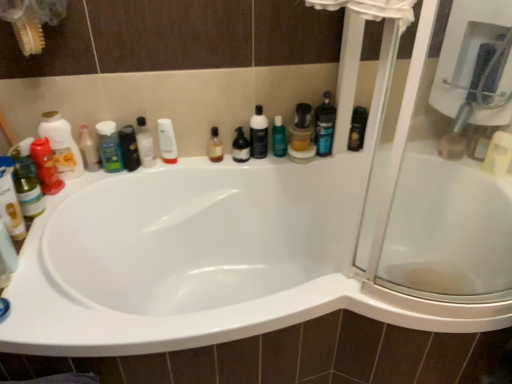
Question: Is black plastic bottle at upper right, the first toiletry when ordered from right to left, next to black glossy bottle at upper left, which is the 1th mouthwash in left-to-right order, and touching it?

Choices:
 (A) no
 (B) yes

Answer: (A)

Question: Can black glossy bottle at upper left, which is the 1th mouthwash in left-to-right order, be found inside black plastic bottle at upper right, the eighth toiletry when ordered from left to right?

Choices:
 (A) no
 (B) yes

Answer: (A)

Question: From the image's perspective, does black plastic bottle at upper right, the eighth toiletry when ordered from left to right, appear lower than black glossy bottle at upper left, the third mouthwash from the right?

Choices:
 (A) yes
 (B) no

Answer: (B)

Question: Is black plastic bottle at upper right, the eighth toiletry when ordered from left to right, positioned in front of black glossy bottle at upper left, which is the 1th mouthwash in left-to-right order?

Choices:
 (A) yes
 (B) no

Answer: (B)

Question: Is black plastic bottle at upper right, the eighth toiletry when ordered from left to right, at the right side of black glossy bottle at upper left, the third mouthwash from the right?

Choices:
 (A) yes
 (B) no

Answer: (A)

Question: Choose the correct answer: Is translucent plastic bottle at center, placed as the second mouthwash when sorted from left to right, inside matte red shampoo at left, arranged as the eighth toiletry when viewed from the right, or outside it?

Choices:
 (A) outside
 (B) inside

Answer: (A)

Question: In terms of width, does translucent plastic bottle at center, placed as the second mouthwash when sorted from left to right, look wider or thinner when compared to matte red shampoo at left, arranged as the eighth toiletry when viewed from the right?

Choices:
 (A) wide
 (B) thin

Answer: (B)

Question: Considering the positions of translucent plastic bottle at center, which appears as the 2th mouthwash when viewed from the right, and matte red shampoo at left, arranged as the eighth toiletry when viewed from the right, in the image, is translucent plastic bottle at center, which appears as the 2th mouthwash when viewed from the right, bigger or smaller than matte red shampoo at left, arranged as the eighth toiletry when viewed from the right,?

Choices:
 (A) big
 (B) small

Answer: (B)

Question: In the image, is translucent plastic bottle at center, which appears as the 2th mouthwash when viewed from the right, positioned in front of or behind matte red shampoo at left, arranged as the eighth toiletry when viewed from the right?

Choices:
 (A) front
 (B) behind

Answer: (B)

Question: In the image, is matte red bottle at left, the 2th cleaning product viewed from the back, on the left side or the right side of green matte shampoo at left, marked as the sixth toiletry in a right-to-left arrangement?

Choices:
 (A) right
 (B) left

Answer: (B)

Question: Considering their positions, is matte red bottle at left, marked as the 1th cleaning product in a left-to-right arrangement, located in front of or behind green matte shampoo at left, marked as the sixth toiletry in a right-to-left arrangement?

Choices:
 (A) front
 (B) behind

Answer: (A)

Question: From a real-world perspective, relative to green matte shampoo at left, marked as the sixth toiletry in a right-to-left arrangement, is matte red bottle at left, acting as the second cleaning product starting from the right, vertically above or below?

Choices:
 (A) above
 (B) below

Answer: (A)

Question: Looking at their shapes, would you say matte red bottle at left, acting as the second cleaning product starting from the right, is wider or thinner than green matte shampoo at left, marked as the sixth toiletry in a right-to-left arrangement?

Choices:
 (A) thin
 (B) wide

Answer: (B)

Question: From the image's perspective, is matte red bottle at left, the first cleaning product in the front-to-back sequence, positioned above or below white glossy lotion at upper center, arranged as the 4th toiletry when viewed from the right?

Choices:
 (A) below
 (B) above

Answer: (A)

Question: Looking at their shapes, would you say matte red bottle at left, the 2th cleaning product viewed from the back, is wider or thinner than white glossy lotion at upper center, arranged as the 4th toiletry when viewed from the right?

Choices:
 (A) thin
 (B) wide

Answer: (B)